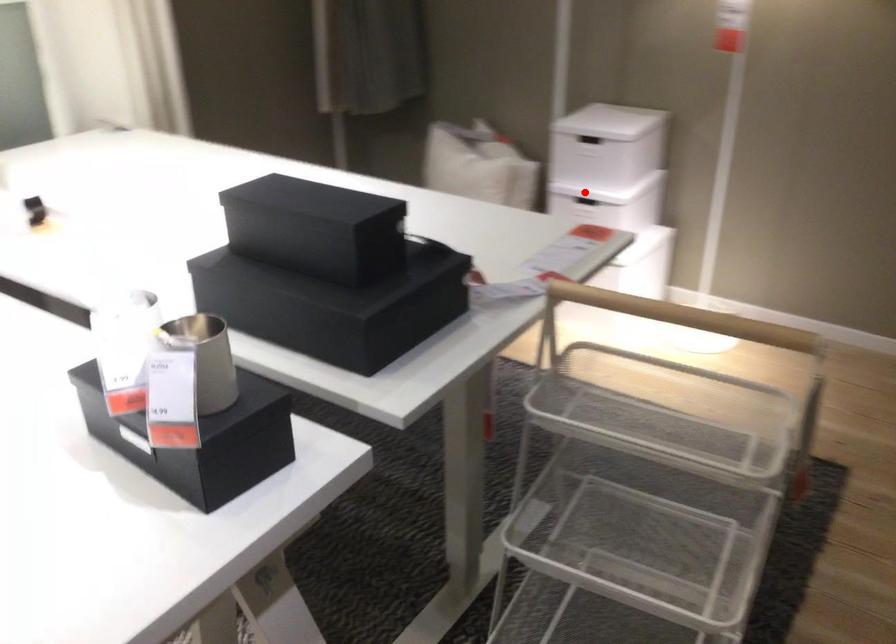
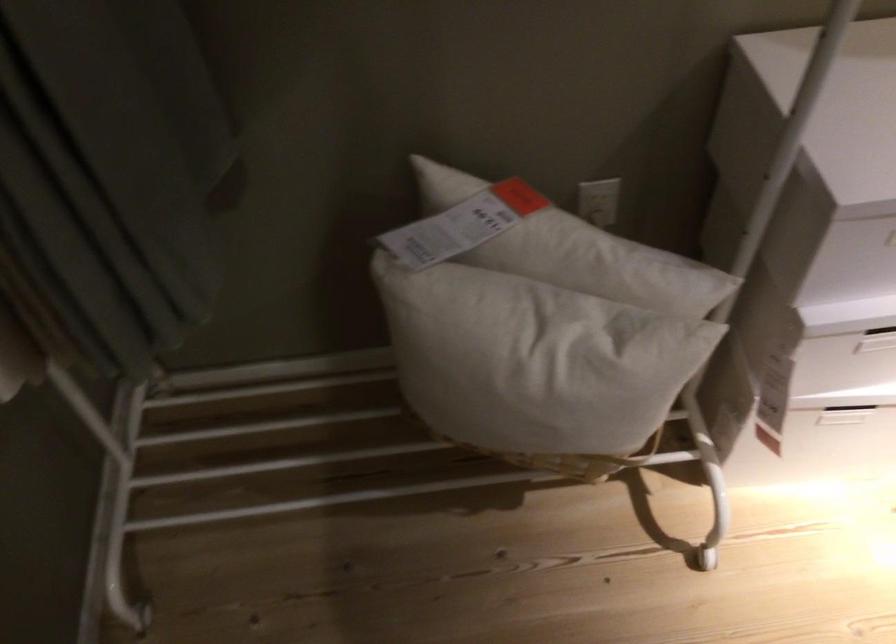
Question: I am providing you with two images of the same scene from different viewpoints. Given a red point in image1, look at the same physical point in image2. Is it:

Choices:
 (A) Closer to the viewpoint
 (B) Farther from the viewpoint

Answer: (A)